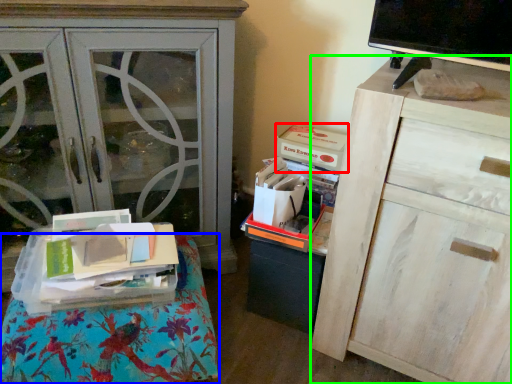
Question: Considering the real-world distances, which object is farthest from storage box (highlighted by a red box)? furniture (highlighted by a blue box) or chest of drawers (highlighted by a green box)?

Choices:
 (A) furniture
 (B) chest of drawers

Answer: (A)